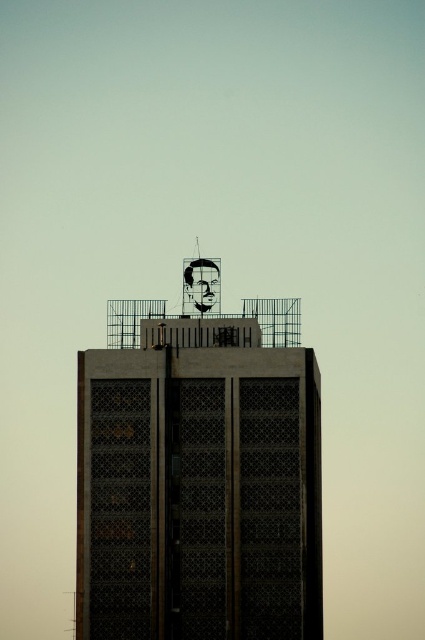
Can you confirm if metallic grid structure at top is smaller than matte black face at top?

Incorrect, metallic grid structure at top is not smaller in size than matte black face at top.

Does point (81, 508) lie behind point (193, 275)?

No, (81, 508) is in front of (193, 275).

Locate an element on the screen. metallic grid structure at top is located at coordinates (198, 476).